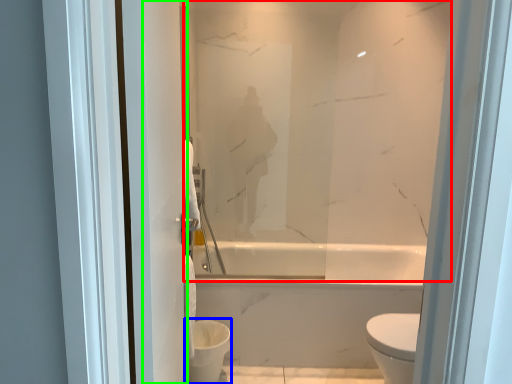
Question: Estimate the real-world distances between objects in this image. Which object is closer to mirror (highlighted by a red box), toilet bowl (highlighted by a blue box) or screen door (highlighted by a green box)?

Choices:
 (A) toilet bowl
 (B) screen door

Answer: (B)